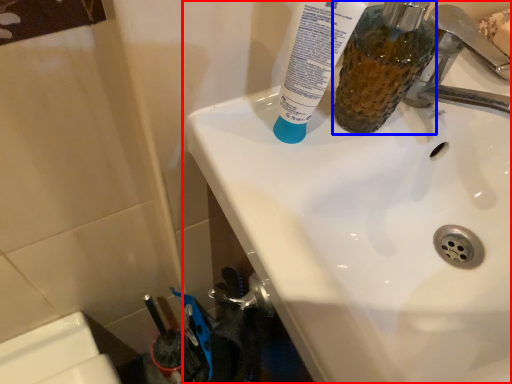
Question: Which object is further to the camera taking this photo, sink (highlighted by a red box) or mouthwash (highlighted by a blue box)?

Choices:
 (A) sink
 (B) mouthwash

Answer: (B)